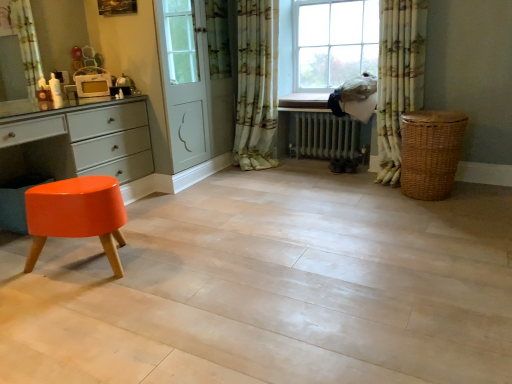
At what (x,y) coordinates should I click in order to perform the action: click on vacant area on top of white metallic radiator at center (from a real-world perspective). Please return your answer as a coordinate pair (x, y). Looking at the image, I should click on (317, 116).